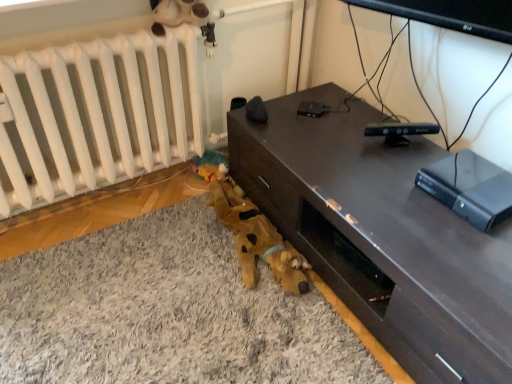
Find the location of a particular element. free point above dark wood desk at center (from a real-world perspective) is located at coordinates (391, 174).